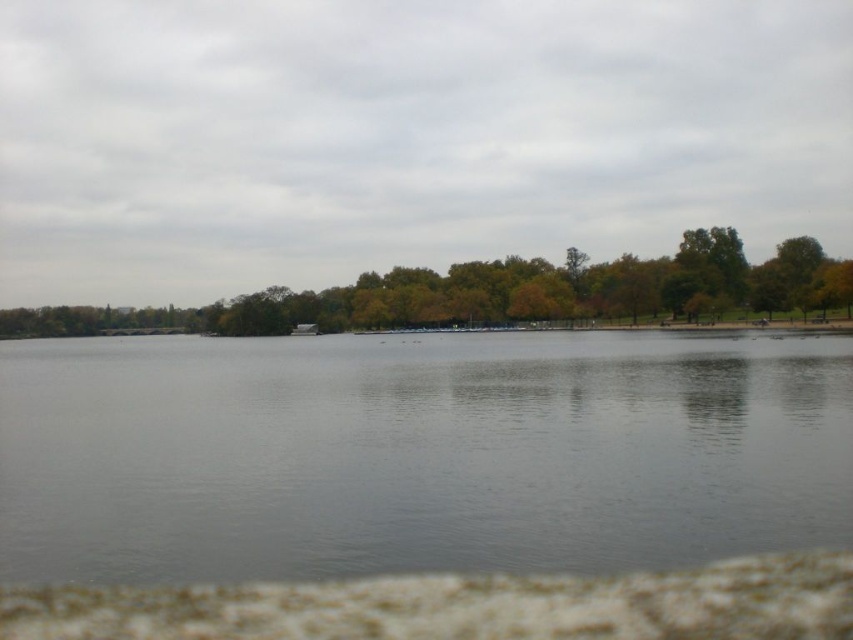
Can you confirm if gray water at center is shorter than green leafy tree at center?

Indeed, gray water at center has a lesser height compared to green leafy tree at center.

Who is shorter, gray water at center or green leafy tree at center?

With less height is gray water at center.

From the picture: Who is more forward, (358, 435) or (79, 314)?

Positioned in front is point (358, 435).

Locate an element on the screen. gray water at center is located at coordinates (416, 452).